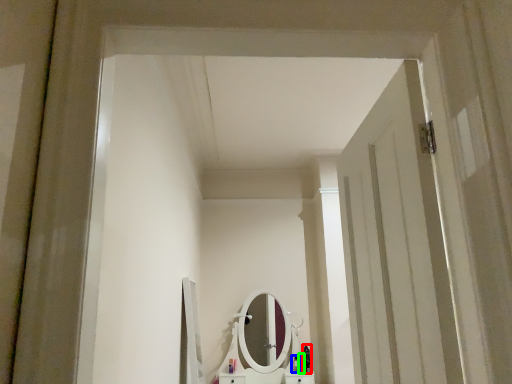
Question: Which is farther away from toiletry (highlighted by a red box)? toiletry (highlighted by a blue box) or toiletry (highlighted by a green box)?

Choices:
 (A) toiletry
 (B) toiletry

Answer: (A)